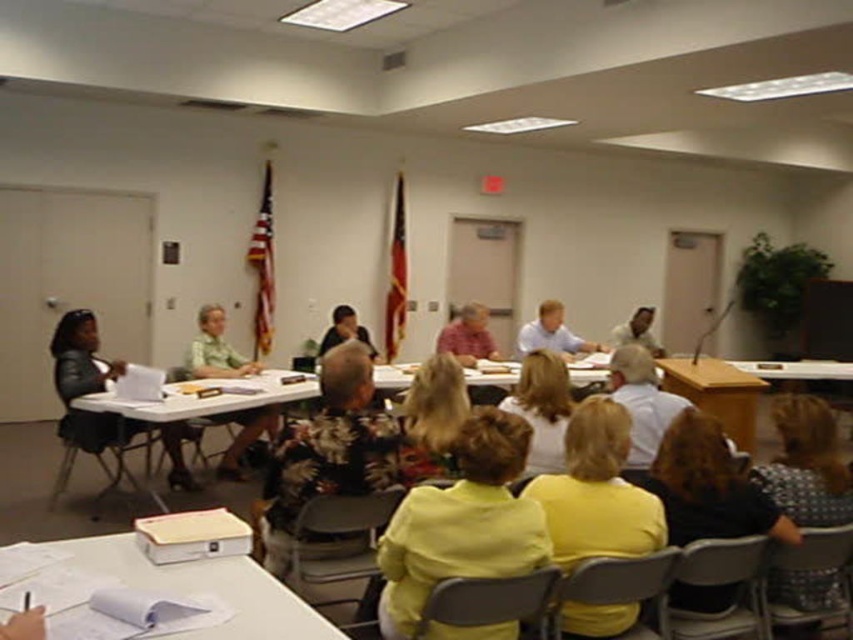
You are a participant in the meeting and you need to find the white paper at lower left. According to the room layout, where exactly should you look for it?

The white paper at lower left is located at point (206, 588) in the room layout.

You are a person who is 5 feet tall and want to sit on the gray plastic chair at lower center. There is a printed fabric blouse at lower right nearby. Can you reach the chair without stepping over the blouse?

The distance between the printed fabric blouse at lower right and the gray plastic chair at lower center is 4.95 feet. Since you are 5 feet tall, you can easily reach the chair without needing to step over the blouse as the distance is sufficient.

You are attending a formal meeting and need to sit down. You see a printed fabric blouse at lower right and a gray plastic chair at lower center. Which object is located to the right of the other?

The printed fabric blouse at lower right is positioned on the right side of gray plastic chair at lower center.